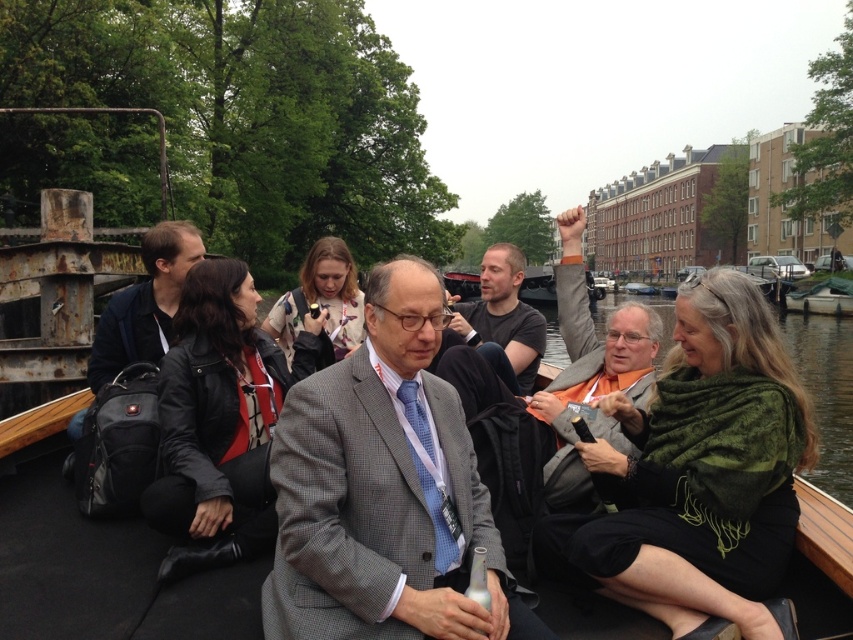
Question: Is gray checkered suit at center further to camera compared to orange fabric sweater at center?

Choices:
 (A) yes
 (B) no

Answer: (B)

Question: Which of the following is the closest to the observer?

Choices:
 (A) dark gray shirt at center
 (B) orange fabric sweater at center
 (C) dark blue fabric jacket at left

Answer: (B)

Question: Considering the relative positions of gray checkered suit at center and dark blue fabric jacket at left in the image provided, where is gray checkered suit at center located with respect to dark blue fabric jacket at left?

Choices:
 (A) below
 (B) above

Answer: (A)

Question: Estimate the real-world distances between objects in this image. Which object is farther from the gray checkered suit at center?

Choices:
 (A) orange fabric sweater at center
 (B) dark gray shirt at center
 (C) dark blue fabric jacket at left

Answer: (C)

Question: Which point appears farthest from the camera in this image?

Choices:
 (A) (558, 214)
 (B) (448, 627)
 (C) (831, 369)

Answer: (A)

Question: Is dark blue fabric jacket at left below dark gray shirt at center?

Choices:
 (A) no
 (B) yes

Answer: (B)